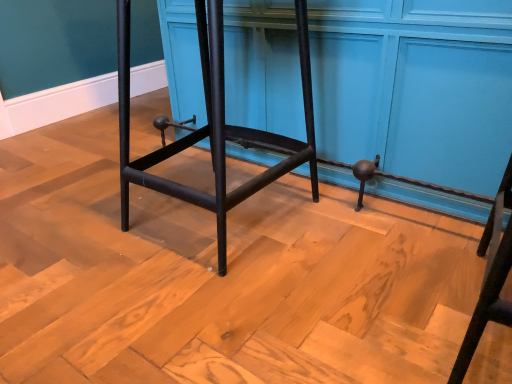
This screenshot has height=384, width=512. In order to click on free space in front of black metal stool at center in this screenshot , I will do `click(211, 308)`.